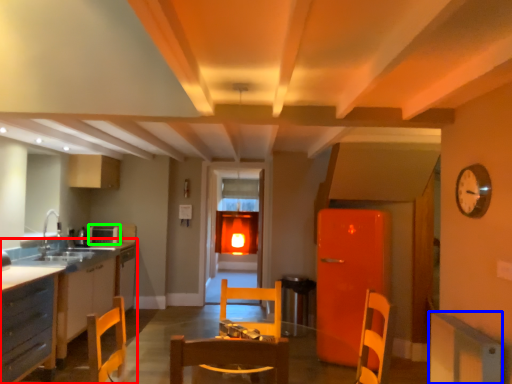
Question: Which is farther away from countertop (highlighted by a red box)? cabinetry (highlighted by a blue box) or appliance (highlighted by a green box)?

Choices:
 (A) cabinetry
 (B) appliance

Answer: (A)